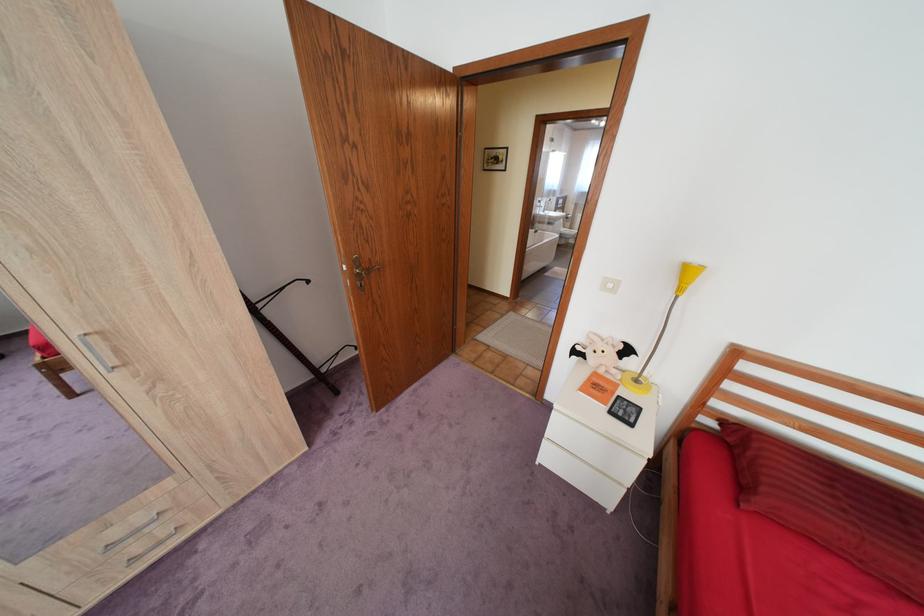
The location [289,334] corresponds to which object?

It corresponds to the black folding stand in the image.